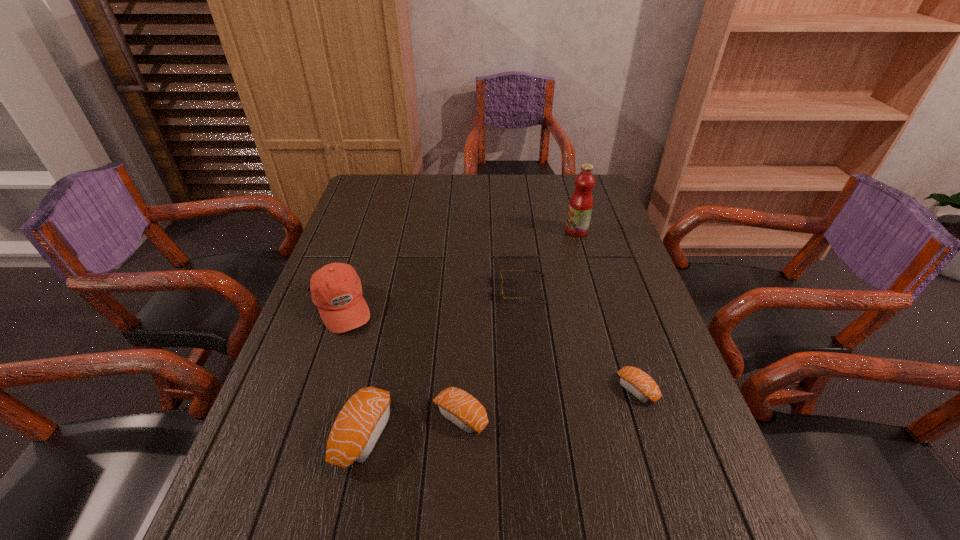
If equal spacing is the goal by inserting an additional sushi among them, please point out a vacant space for this new sushi. Please provide its 2D coordinates. Your answer should be formatted as a tuple, i.e. [(x, y)], where the tuple contains the x and y coordinates of a point satisfying the conditions above.

[(551, 402)]